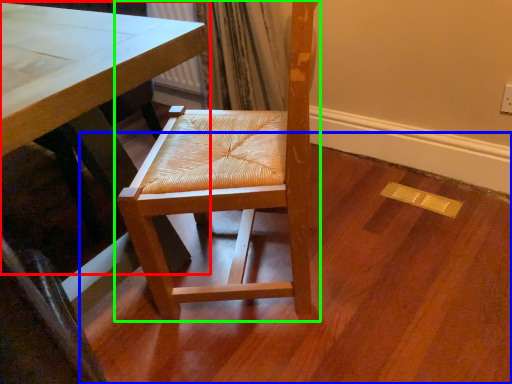
Question: Which is nearer to the table (highlighted by a red box)? plywood (highlighted by a blue box) or chair (highlighted by a green box).

Choices:
 (A) plywood
 (B) chair

Answer: (B)